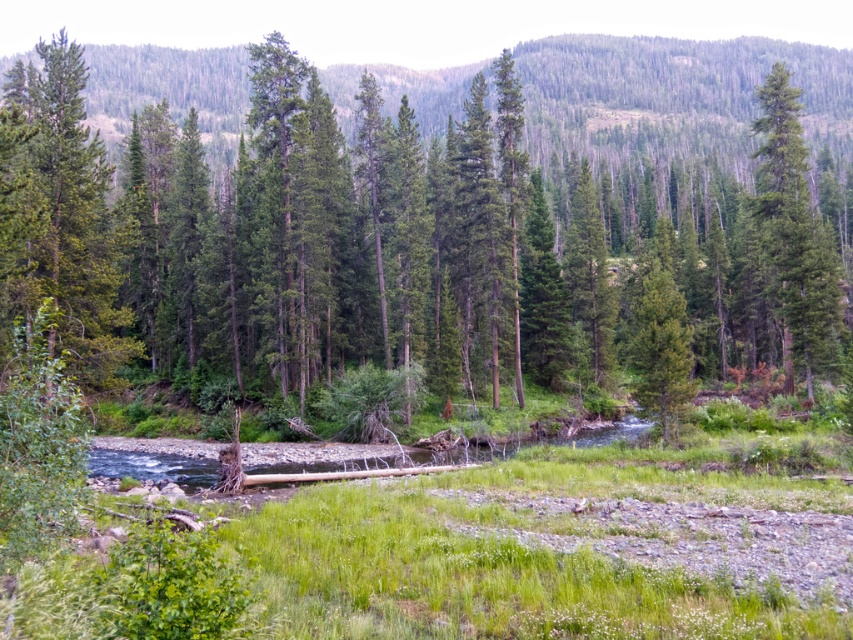
Between green matte tree at center and green matte tree at right, which one has less height?

Standing shorter between the two is green matte tree at right.

What do you see at coordinates (438, 225) in the screenshot?
I see `green matte tree at center` at bounding box center [438, 225].

Which is in front, point (514, 224) or point (816, 349)?

Point (816, 349)

Find the location of a particular element. green matte tree at center is located at coordinates (438, 225).

Does green matte tree at center appear under green matte tree at left?

No, green matte tree at center is not below green matte tree at left.

Consider the image. Can you confirm if green matte tree at center is thinner than green matte tree at left?

In fact, green matte tree at center might be wider than green matte tree at left.

The image size is (853, 640). What do you see at coordinates (438, 225) in the screenshot? I see `green matte tree at center` at bounding box center [438, 225].

The image size is (853, 640). I want to click on green matte tree at center, so click(438, 225).

Between green matte tree at left and green matte tree at right, which one has more height?

green matte tree at left

Can you confirm if green matte tree at left is positioned above green matte tree at right?

No.

Which is in front, point (22, 189) or point (790, 172)?

Point (22, 189) is in front.

At what (x,y) coordinates should I click in order to perform the action: click on green matte tree at left. Please return your answer as a coordinate pair (x, y). Looking at the image, I should click on (57, 218).